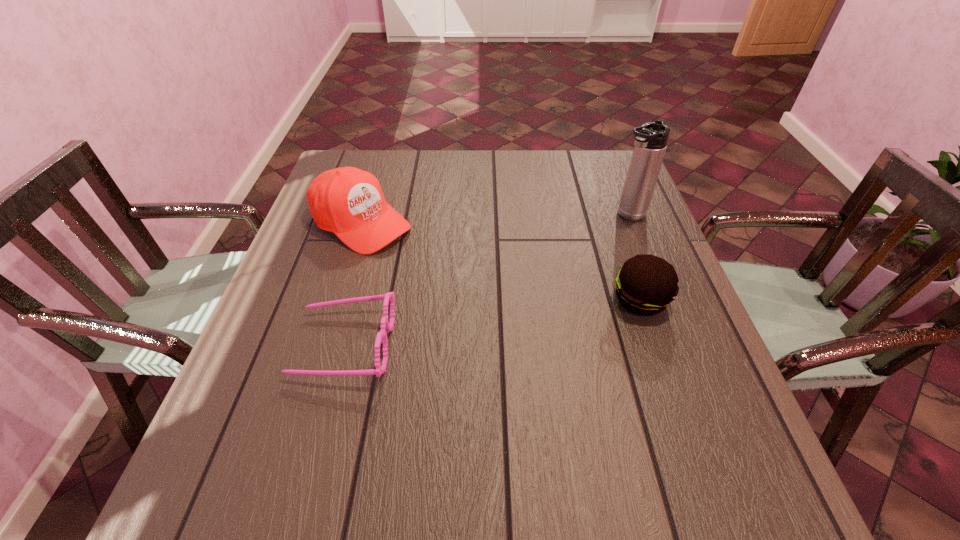
You are a GUI agent. You are given a task and a screenshot of the screen. Output one action in this format:
    pyautogui.click(x=<x>, y=<y>)
    Task: Click on the vacant space located 0.100m on the front panel of the baseball cap
    The width and height of the screenshot is (960, 540).
    Given the screenshot: What is the action you would take?
    tap(423, 261)

Identify the location of free location located 0.160m on the front panel of the baseball cap. (442, 272).

Find the location of `vacant space located 0.270m on the front panel of the baseball cap`. vacant space located 0.270m on the front panel of the baseball cap is located at coordinates (476, 294).

Identify the location of spectacles at the left edge. (381, 337).

Find the location of `baseball cap that is at the left edge`. baseball cap that is at the left edge is located at coordinates (349, 202).

Locate an element on the screen. The image size is (960, 540). patty situated at the right edge is located at coordinates (646, 284).

Where is `thermos bottle located in the right edge section of the desktop`? thermos bottle located in the right edge section of the desktop is located at coordinates (651, 139).

I want to click on vacant point at the far edge, so click(x=398, y=192).

Find the location of a particular element. blank area at the near edge is located at coordinates (363, 430).

I want to click on vacant region at the left edge, so click(x=247, y=374).